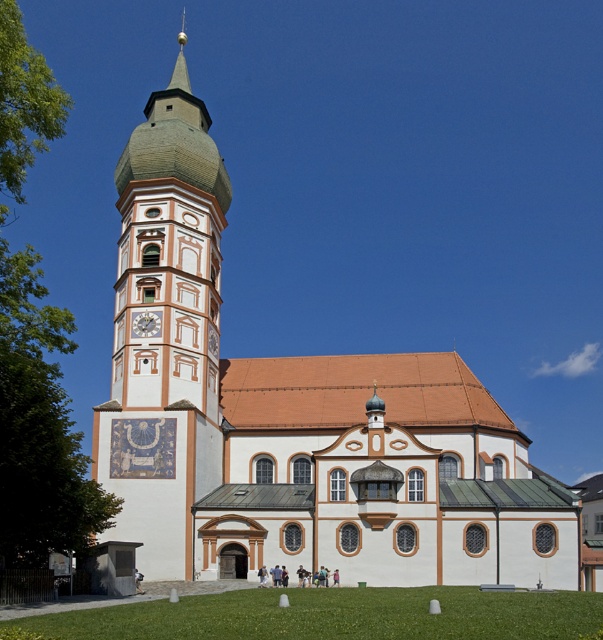
Is matte white tower at left smaller than matte white clock at center-left?

Incorrect, matte white tower at left is not smaller in size than matte white clock at center-left.

This screenshot has height=640, width=603. I want to click on matte white tower at left, so click(165, 330).